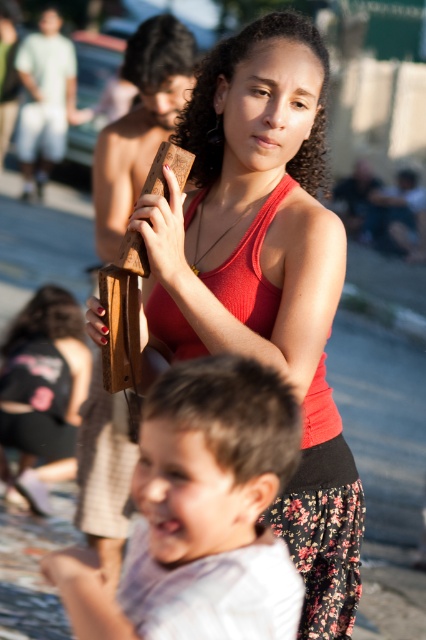
Between point (189, 344) and point (178, 339), which one is positioned behind?

The point (178, 339) is behind.

Is matte wood block at center wider than ribbed red tank top at center?

Correct, the width of matte wood block at center exceeds that of ribbed red tank top at center.

Does point (221, 228) come behind point (224, 285)?

Yes, it is behind point (224, 285).

Identify the location of matte wood block at center. This screenshot has width=426, height=640. (265, 276).

Does point (83, 364) come closer to viewer compared to point (267, 284)?

No, (83, 364) is behind (267, 284).

Image resolution: width=426 pixels, height=640 pixels. Describe the element at coordinates (43, 392) in the screenshot. I see `matte brown wooden object at center` at that location.

Where is `matte brown wooden object at center`? The width and height of the screenshot is (426, 640). matte brown wooden object at center is located at coordinates (43, 392).

The width and height of the screenshot is (426, 640). Find the location of `matte wood block at center`. matte wood block at center is located at coordinates (265, 276).

Measure the distance between matte wood block at center and camera.

They are 3.03 meters apart.

Does point (294, 531) come closer to viewer compared to point (154, 401)?

That is False.

Find the location of `matte wood block at center`. matte wood block at center is located at coordinates (265, 276).